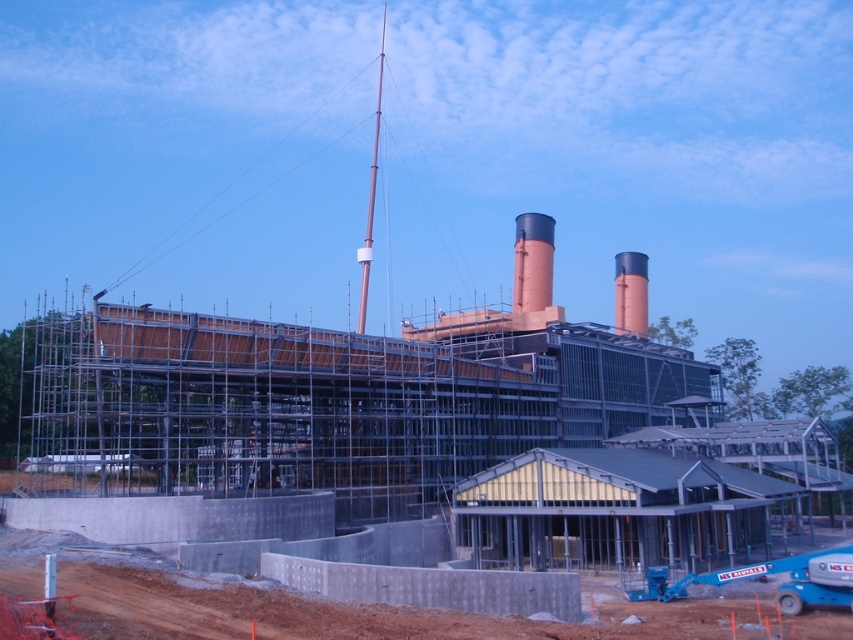
Question: Which object is positioned closest to the brown dirt track at lower left?

Choices:
 (A) orange matte chimney at center-right
 (B) rustic brick chimney at center
 (C) metal scaffolding at center

Answer: (C)

Question: Where is metal scaffolding at center located in relation to rustic brick chimney at center in the image?

Choices:
 (A) below
 (B) above

Answer: (A)

Question: Is metal scaffolding at center smaller than orange matte chimney at center-right?

Choices:
 (A) no
 (B) yes

Answer: (A)

Question: Can you confirm if rustic brick chimney at center is positioned to the left of orange matte chimney at center-right?

Choices:
 (A) no
 (B) yes

Answer: (B)

Question: Which object appears closest to the camera in this image?

Choices:
 (A) metal scaffolding at center
 (B) brown dirt track at lower left
 (C) rustic brick chimney at center
 (D) orange matte chimney at center-right

Answer: (B)

Question: Based on their relative distances, which object is nearer to the brown dirt track at lower left?

Choices:
 (A) metal scaffolding at center
 (B) rustic brick chimney at center
 (C) orange matte chimney at center-right

Answer: (A)